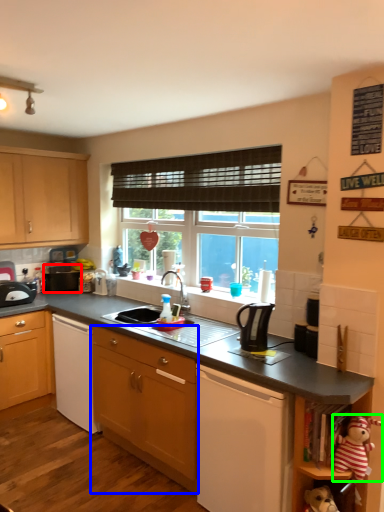
Question: Which object is the closest to the appliance (highlighted by a red box)? Choose among these: cabinetry (highlighted by a blue box) or toy (highlighted by a green box).

Choices:
 (A) cabinetry
 (B) toy

Answer: (A)